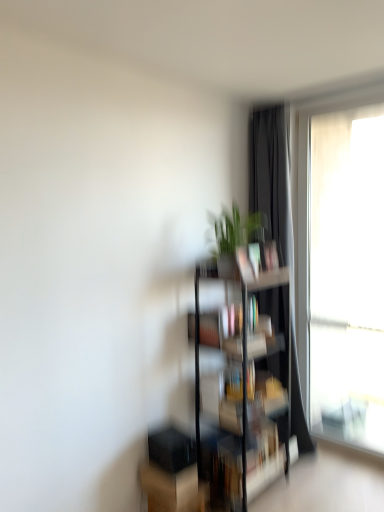
Find the location of a particular element. This screenshot has width=384, height=512. translucent fabric at right is located at coordinates (342, 267).

What do you see at coordinates (234, 230) in the screenshot? I see `green matte plant at center` at bounding box center [234, 230].

This screenshot has width=384, height=512. Identify the location of black matte curtain at right. (272, 176).

What do you see at coordinates (272, 176) in the screenshot? Image resolution: width=384 pixels, height=512 pixels. I see `black matte curtain at right` at bounding box center [272, 176].

This screenshot has width=384, height=512. Identify the location of matte black bookshelf at center. (220, 325).

Could translucent fabric at right be considered to be inside matte black bookshelf at center?

That's incorrect, translucent fabric at right is not inside matte black bookshelf at center.

Which is further, (210,328) or (305,120)?

The point (305,120) is farther from the camera.

Is matte black bookshelf at center aimed at translucent fabric at right?

No, matte black bookshelf at center is not aimed at translucent fabric at right.

Does matte black bookshelf at center appear on the left side of green matte plant at center?

Correct, you'll find matte black bookshelf at center to the left of green matte plant at center.

Is matte black bookshelf at center aimed at green matte plant at center?

No, matte black bookshelf at center does not turn towards green matte plant at center.

From a real-world perspective, who is located lower, matte black bookshelf at center or green matte plant at center?

In real-world perspective, matte black bookshelf at center is lower.

Is matte black bookshelf at center in front of or behind green matte plant at center in the image?

matte black bookshelf at center is behind green matte plant at center.

Identify the location of curtain behind the matte black bookshelf at center. This screenshot has height=512, width=384. (272, 176).

Looking at this image, considering the positions of objects black matte curtain at right and matte black bookshelf at center in the image provided, who is more to the left, black matte curtain at right or matte black bookshelf at center?

From the viewer's perspective, matte black bookshelf at center appears more on the left side.

Would you say black matte curtain at right contains matte black bookshelf at center?

No, matte black bookshelf at center is not a part of black matte curtain at right.

Is black matte curtain at right positioned far away from matte black bookshelf at center?

No, black matte curtain at right is not far away from matte black bookshelf at center.

Is translucent fabric at right next to black matte curtain at right and touching it?

No, translucent fabric at right is not with black matte curtain at right.

From the image's perspective, is translucent fabric at right located beneath black matte curtain at right?

No, from the image's perspective, translucent fabric at right is not beneath black matte curtain at right.

Choose the correct answer: Is translucent fabric at right inside black matte curtain at right or outside it?

translucent fabric at right is not inside black matte curtain at right, it's outside.

In the scene shown: Between translucent fabric at right and black matte curtain at right, which one has less height?

translucent fabric at right is shorter.

Would you say clear glass bookshelf at center contains matte black bookshelf at center?

Absolutely, matte black bookshelf at center is inside clear glass bookshelf at center.

From the image's perspective, is clear glass bookshelf at center on matte black bookshelf at center?

No, from the image's perspective, clear glass bookshelf at center is not on top of matte black bookshelf at center.

In the scene shown: Would you consider clear glass bookshelf at center to be distant from matte black bookshelf at center?

They are positioned close to each other.

Is the depth of black matte curtain at right less than that of translucent fabric at right?

Yes, the depth of black matte curtain at right is less than that of translucent fabric at right.

Consider the image. Considering the sizes of black matte curtain at right and translucent fabric at right in the image, is black matte curtain at right taller or shorter than translucent fabric at right?

black matte curtain at right is taller than translucent fabric at right.

From a real-world perspective, which is physically above, black matte curtain at right or translucent fabric at right?

translucent fabric at right, from a real-world perspective.

Does clear glass bookshelf at center have a smaller size compared to green matte plant at center?

Actually, clear glass bookshelf at center might be larger than green matte plant at center.

Is green matte plant at center surrounded by clear glass bookshelf at center?

No, clear glass bookshelf at center does not contain green matte plant at center.

Is clear glass bookshelf at center beside green matte plant at center?

clear glass bookshelf at center is not next to green matte plant at center, and they're not touching.

Find the location of a particular element. This screenshot has width=384, height=512. window above the matte black bookshelf at center (from the image's perspective) is located at coordinates (342, 267).

What are the coordinates of `book behind the green matte plant at center` in the screenshot? It's located at (220, 325).

Which object lies further to the anchor point green matte plant at center, clear glass bookshelf at center or black matte curtain at right?

clear glass bookshelf at center is further to green matte plant at center.

Looking at the image, which one is located further to matte black bookshelf at center, black matte curtain at right or translucent fabric at right?

translucent fabric at right.

When comparing their distances from translucent fabric at right, does green matte plant at center or clear glass bookshelf at center seem further?

green matte plant at center is positioned further to the anchor translucent fabric at right.

Consider the image. Looking at the image, which one is located further to green matte plant at center, translucent fabric at right or matte black bookshelf at center?

translucent fabric at right is further to green matte plant at center.

Considering their positions, is black matte curtain at right positioned further to green matte plant at center than translucent fabric at right?

translucent fabric at right is further to green matte plant at center.

Estimate the real-world distances between objects in this image. Which object is closer to translucent fabric at right, green matte plant at center or matte black bookshelf at center?

The object closer to translucent fabric at right is green matte plant at center.

From the image, which object appears to be farther from clear glass bookshelf at center, green matte plant at center or matte black bookshelf at center?

Among the two, green matte plant at center is located further to clear glass bookshelf at center.

From the image, which object appears to be nearer to matte black bookshelf at center, translucent fabric at right or black matte curtain at right?

black matte curtain at right.

The height and width of the screenshot is (512, 384). I want to click on curtain situated between clear glass bookshelf at center and translucent fabric at right from left to right, so click(x=272, y=176).

This screenshot has height=512, width=384. I want to click on curtain between green matte plant at center and translucent fabric at right, so click(x=272, y=176).

Identify the location of curtain between green matte plant at center and clear glass bookshelf at center in the up-down direction. 272,176.

This screenshot has height=512, width=384. Find the location of `shelf located between matte black bookshelf at center and translucent fabric at right in the left-right direction`. shelf located between matte black bookshelf at center and translucent fabric at right in the left-right direction is located at coordinates (243, 376).